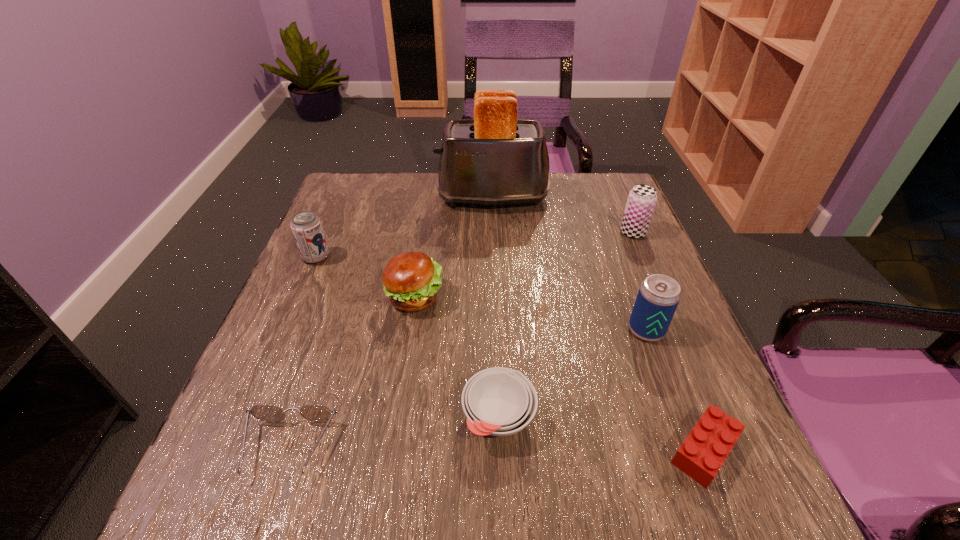
Locate an element on the screen. Image resolution: width=960 pixels, height=540 pixels. empty space that is in between the tallest object and the hamburger is located at coordinates (453, 247).

Where is `free spot between the leftmost beer can and the spectacles`? This screenshot has height=540, width=960. free spot between the leftmost beer can and the spectacles is located at coordinates tap(302, 353).

Identify which object is located as the third nearest to the hamburger. Please provide its 2D coordinates. Your answer should be formatted as a tuple, i.e. [(x, y)], where the tuple contains the x and y coordinates of a point satisfying the conditions above.

[(313, 412)]

Identify the location of object that stands as the sixth closest to the tallest object. (705, 449).

Where is `the closest beer can to the tallest object`? This screenshot has height=540, width=960. the closest beer can to the tallest object is located at coordinates (642, 199).

Find the location of a particular element. Image resolution: width=960 pixels, height=540 pixels. beer can that is the closest to the soup bowl is located at coordinates (658, 297).

Where is `free space in the image that satisfies the following two spatial constraints: 1. on the side of the tallest object with the control lever; 2. on the left side of the second farthest object`? The width and height of the screenshot is (960, 540). free space in the image that satisfies the following two spatial constraints: 1. on the side of the tallest object with the control lever; 2. on the left side of the second farthest object is located at coordinates (493, 233).

The width and height of the screenshot is (960, 540). I want to click on blank space that satisfies the following two spatial constraints: 1. on the side of the farthest object with the control lever; 2. on the left side of the shortest object, so click(502, 450).

You are a GUI agent. You are given a task and a screenshot of the screen. Output one action in this format:
    pyautogui.click(x=<x>, y=<y>)
    Task: Click on the vacant region that satisfies the following two spatial constraints: 1. on the side of the toaster with the control lever; 2. on the front-facing side of the spectacles
    Image resolution: width=960 pixels, height=540 pixels.
    Given the screenshot: What is the action you would take?
    pyautogui.click(x=502, y=448)

Where is `vacant space that satisfies the following two spatial constraints: 1. on the back side of the nearest beer can; 2. on the right side of the seventh nearest object`? vacant space that satisfies the following two spatial constraints: 1. on the back side of the nearest beer can; 2. on the right side of the seventh nearest object is located at coordinates (611, 233).